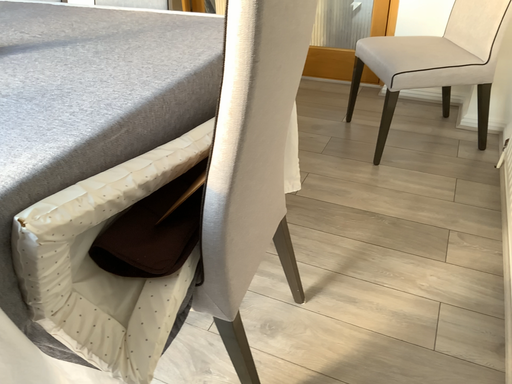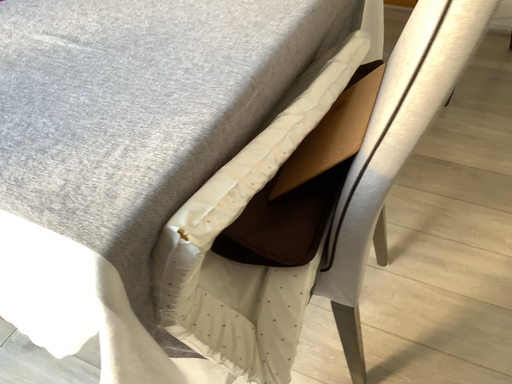
Question: Which way did the camera rotate in the video?

Choices:
 (A) rotated upward
 (B) rotated downward

Answer: (B)